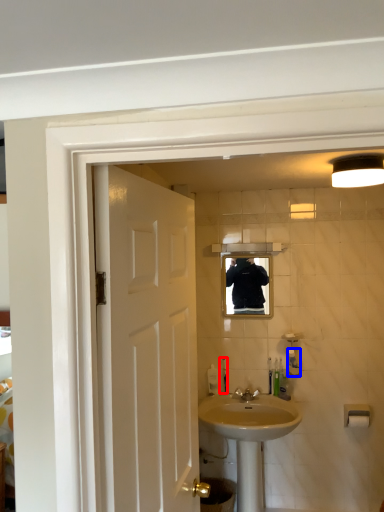
Question: Which object is further to the camera taking this photo, toiletry (highlighted by a red box) or toiletry (highlighted by a blue box)?

Choices:
 (A) toiletry
 (B) toiletry

Answer: (A)